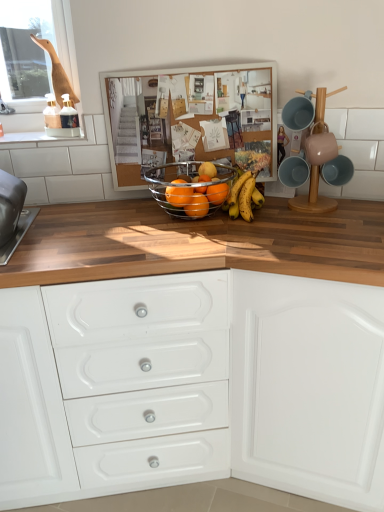
The height and width of the screenshot is (512, 384). Identify the location of vacant area in front of metallic wire basket at center. (190, 244).